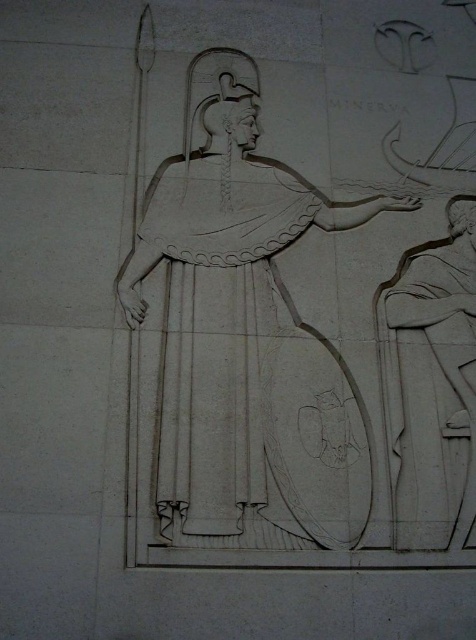
The height and width of the screenshot is (640, 476). In order to click on white stone relief at center in this screenshot , I will do `click(240, 339)`.

Between white stone relief at center and white stone figure at right, which one is positioned lower?

white stone figure at right is below.

Is point (230, 424) positioned after point (436, 266)?

That is False.

The image size is (476, 640). Find the location of `white stone relief at center`. white stone relief at center is located at coordinates (240, 339).